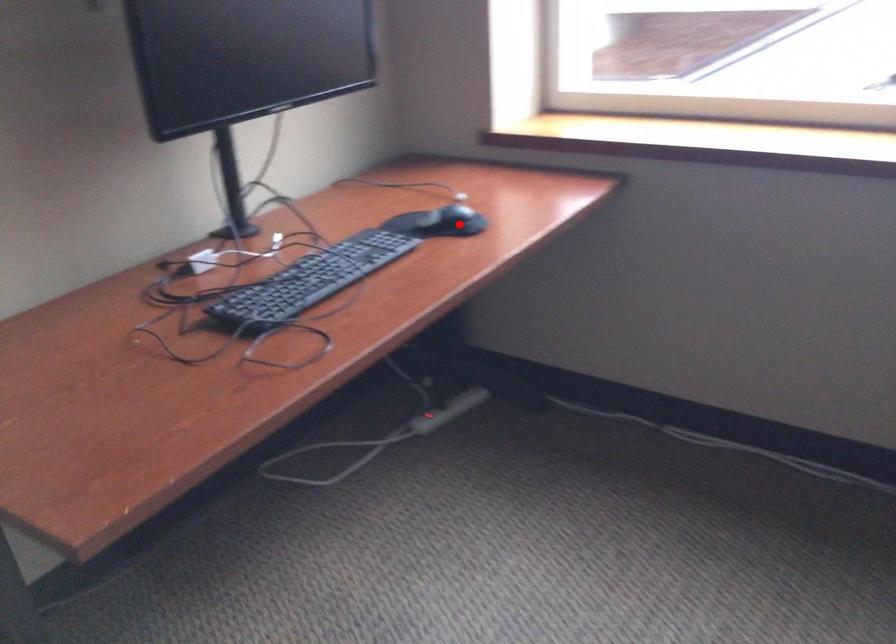
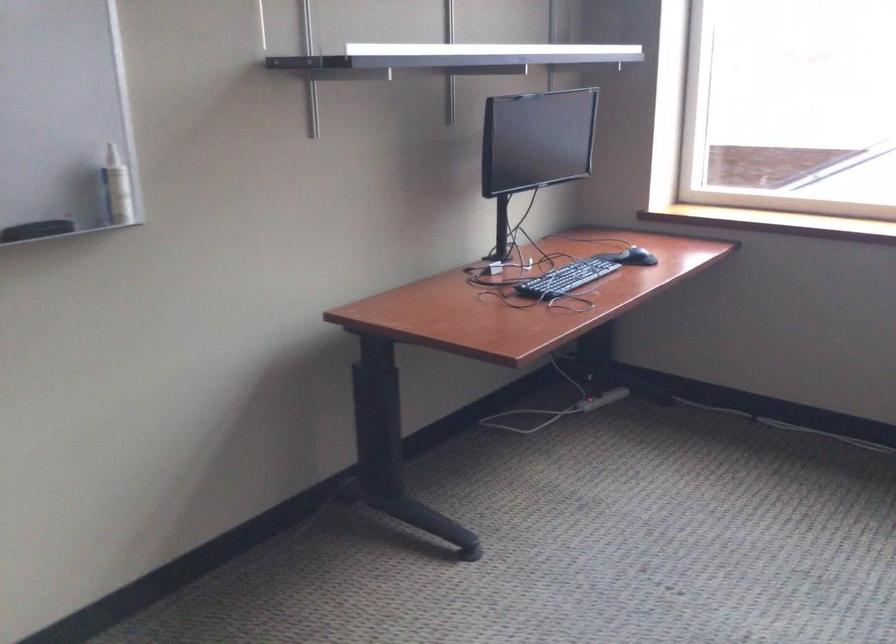
Question: I am providing you with two images of the same scene from different viewpoints. A red point is marked on the first image. At the location where the point appears in image 1, is it still visible in image 2?

Choices:
 (A) Yes
 (B) No

Answer: (A)